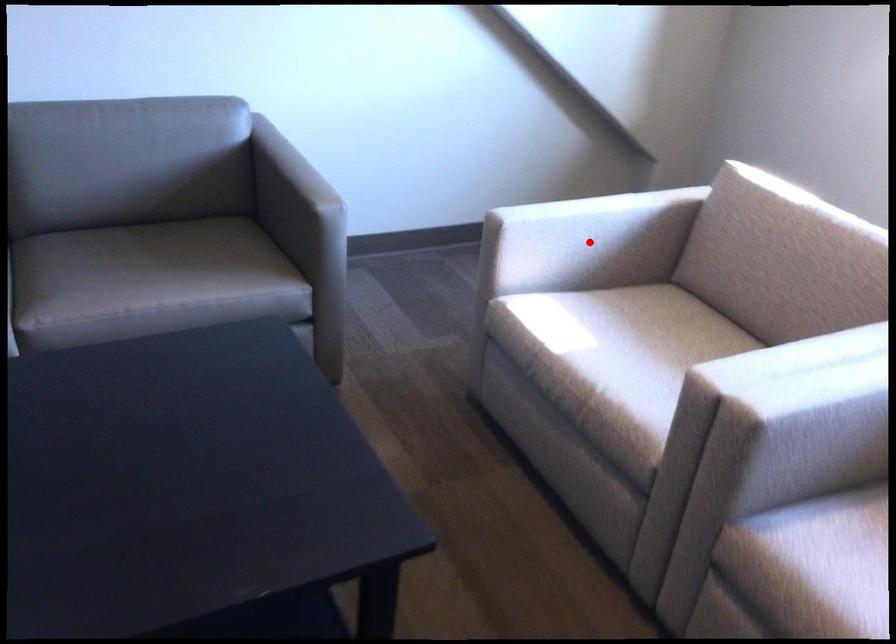
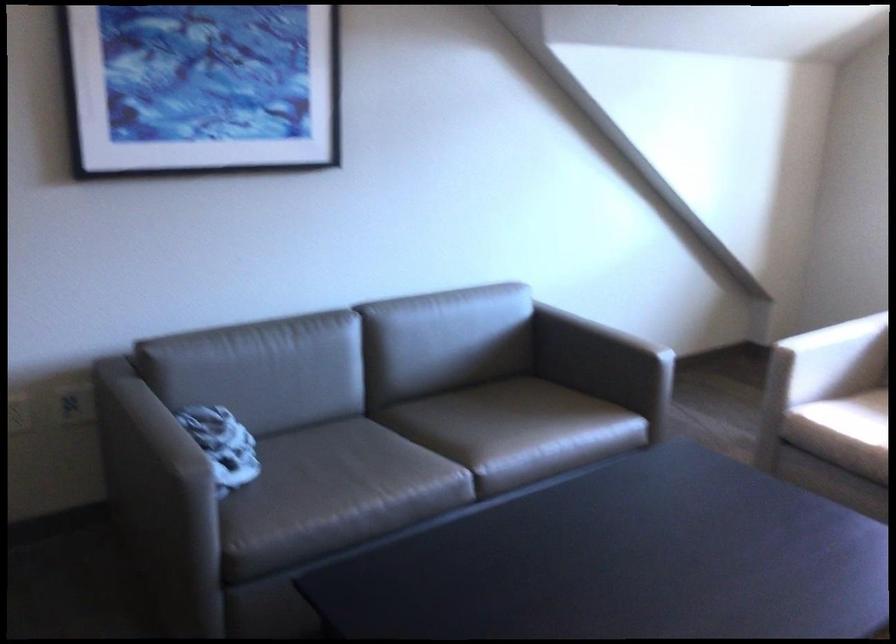
Find the pixel in the second image that matches the highlighted location in the first image.

(831, 359)